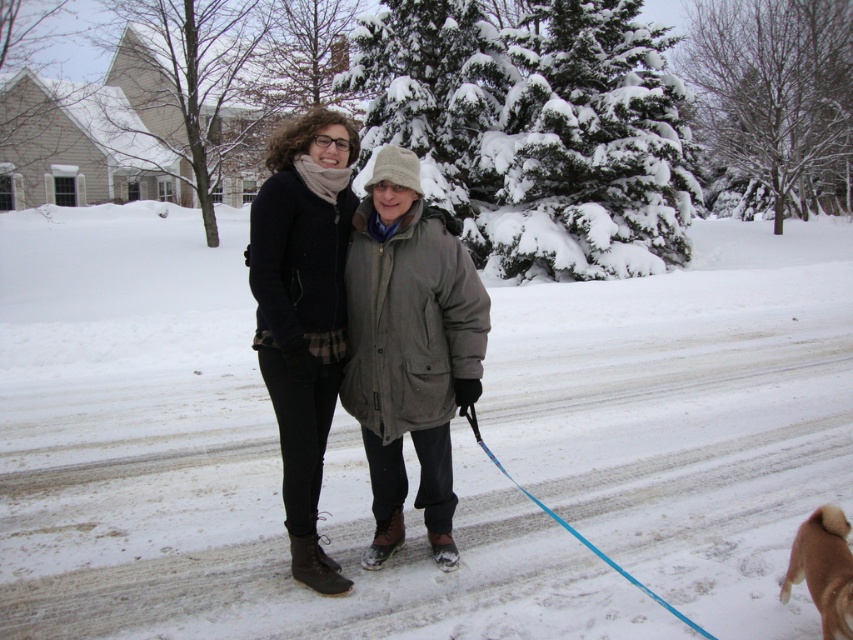
Is the position of white fluffy snow at center less distant than that of matte black coat at center?

No, white fluffy snow at center is further to the viewer.

What do you see at coordinates (218, 465) in the screenshot? I see `white fluffy snow at center` at bounding box center [218, 465].

Image resolution: width=853 pixels, height=640 pixels. What are the coordinates of `white fluffy snow at center` in the screenshot? It's located at (218, 465).

Is point (289, 609) positioned after point (834, 588)?

Yes.

The image size is (853, 640). I want to click on white fluffy snow at center, so click(x=218, y=465).

In order to click on white fluffy snow at center in this screenshot , I will do `click(218, 465)`.

Can you confirm if white fluffy snow at center is positioned below dark gray knit sweater at center?

Incorrect, white fluffy snow at center is not positioned below dark gray knit sweater at center.

Which is behind, point (132, 428) or point (285, 179)?

Point (132, 428)

Find the location of a particular element. The image size is (853, 640). white fluffy snow at center is located at coordinates (218, 465).